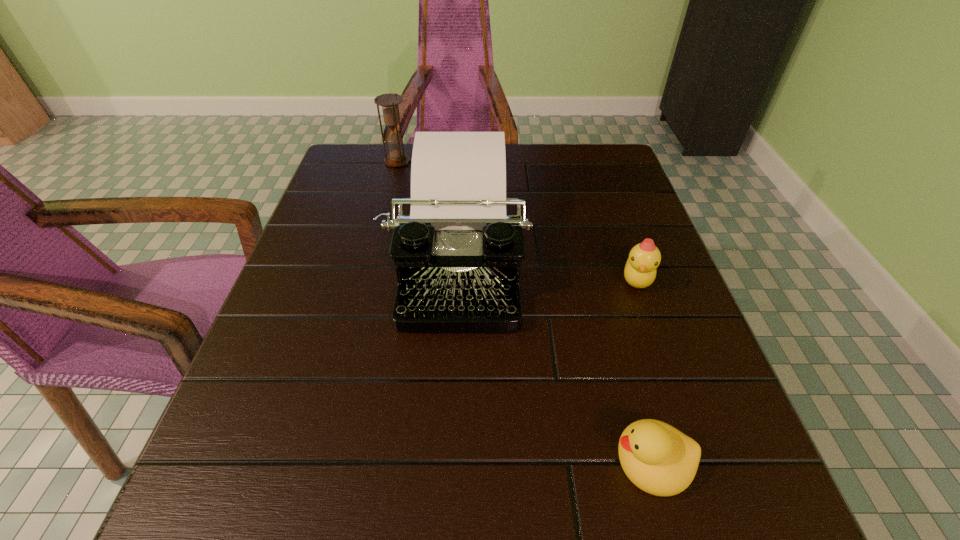
At what (x,y) coordinates should I click in order to perform the action: click on vacant region at the right edge. Please return your answer as a coordinate pair (x, y). This screenshot has width=960, height=540. Looking at the image, I should click on (708, 369).

At what (x,y) coordinates should I click in order to perform the action: click on vacant region at the far left corner of the desktop. Please return your answer as a coordinate pair (x, y). Looking at the image, I should click on (360, 155).

This screenshot has height=540, width=960. I want to click on vacant area at the near left corner of the desktop, so click(x=195, y=507).

Locate an element on the screen. unoccupied area between the typewriter and the nearer duckling is located at coordinates click(x=554, y=361).

You are a GUI agent. You are given a task and a screenshot of the screen. Output one action in this format:
    pyautogui.click(x=<x>, y=<y>)
    Task: Click on the vacant space in between the nearer duckling and the farthest object
    This screenshot has height=540, width=960.
    Given the screenshot: What is the action you would take?
    pyautogui.click(x=524, y=311)

Where is `vacant area between the shorter duckling and the taller duckling`? This screenshot has height=540, width=960. vacant area between the shorter duckling and the taller duckling is located at coordinates (643, 370).

This screenshot has height=540, width=960. Identify the location of blank region between the typewriter and the second shortest object. pos(546,270).

The image size is (960, 540). Find the location of `free spot between the typewriter and the shortest object`. free spot between the typewriter and the shortest object is located at coordinates tap(554, 361).

Identify the location of free space between the typewriter and the shorter duckling. This screenshot has height=540, width=960. (554, 361).

The image size is (960, 540). Identify the location of vacant space in between the shorter duckling and the farthest object. (524, 311).